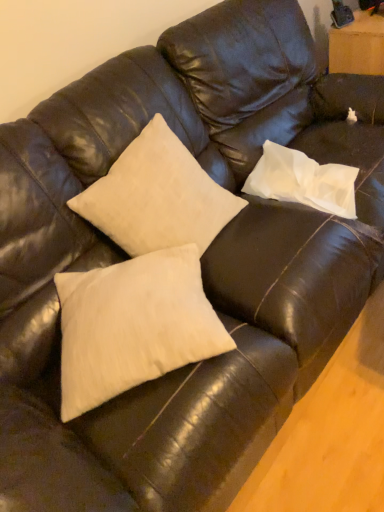
Where is `white cotton pillow at center`? This screenshot has height=512, width=384. white cotton pillow at center is located at coordinates (133, 325).

Describe the element at coordinates (133, 325) in the screenshot. I see `white cotton pillow at center` at that location.

This screenshot has height=512, width=384. Find the location of `white cotton pillow at center`. white cotton pillow at center is located at coordinates (133, 325).